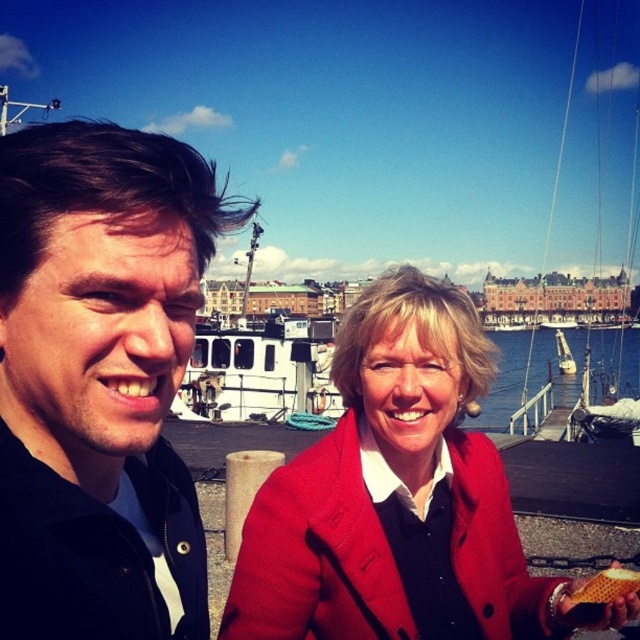
Question: Is matte red coat at center below golden honeycomb at lower right?

Choices:
 (A) yes
 (B) no

Answer: (B)

Question: Considering the relative positions of matte red coat at center and golden honeycomb at lower right in the image provided, where is matte red coat at center located with respect to golden honeycomb at lower right?

Choices:
 (A) below
 (B) above

Answer: (B)

Question: Among these points, which one is farthest from the camera?

Choices:
 (A) (100, 506)
 (B) (582, 605)

Answer: (B)

Question: Which object is the farthest from the golden honeycomb at lower right?

Choices:
 (A) matte red coat at center
 (B) blue water at center

Answer: (B)

Question: Which point appears farthest from the camera in this image?

Choices:
 (A) (572, 598)
 (B) (445, 400)

Answer: (B)

Question: Does blue water at center have a smaller size compared to golden honeycomb at lower right?

Choices:
 (A) no
 (B) yes

Answer: (A)